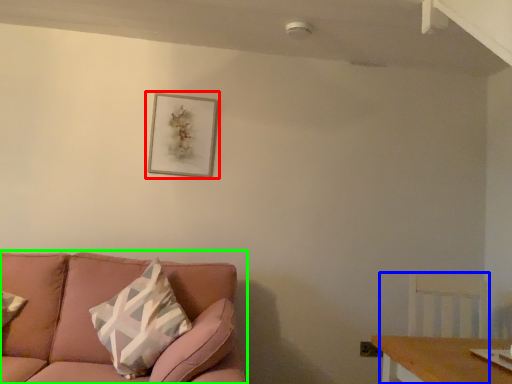
Question: Based on their relative distances, which object is nearer to picture frame (highlighted by a red box)? Choose from swivel chair (highlighted by a blue box) and studio couch (highlighted by a green box).

Choices:
 (A) swivel chair
 (B) studio couch

Answer: (B)